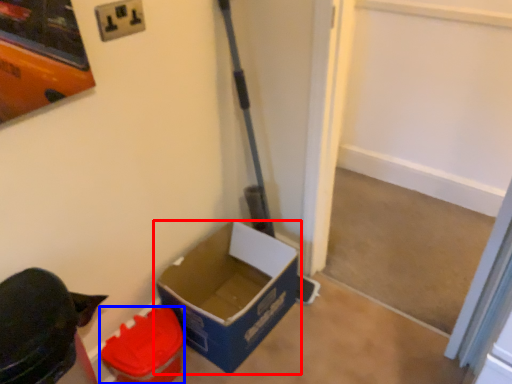
Question: Among these objects, which one is farthest to the camera, box (highlighted by a red box) or box (highlighted by a blue box)?

Choices:
 (A) box
 (B) box

Answer: (A)